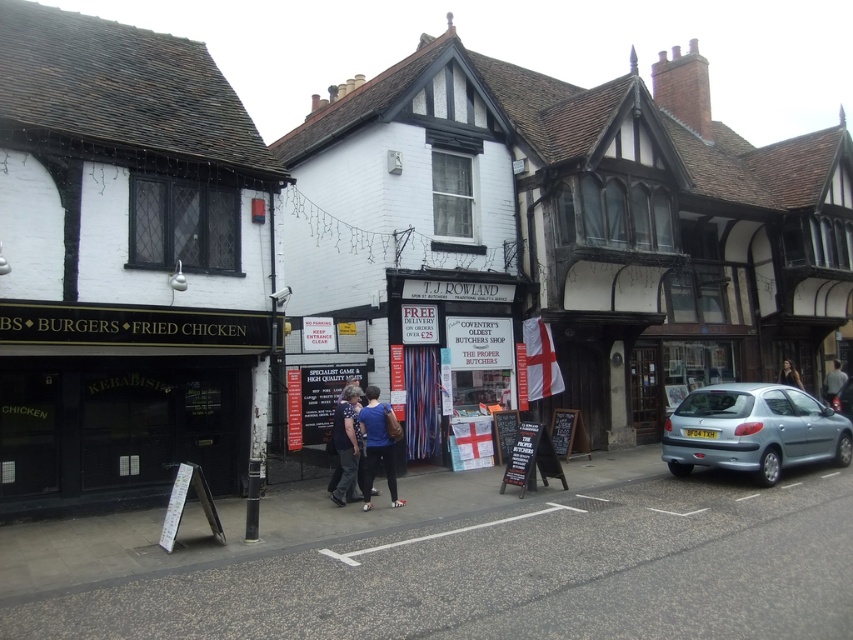
Is metallic silver car at right in front of gray fabric shirt at center-right?

That is True.

Can you confirm if metallic silver car at right is positioned to the right of gray fabric shirt at center-right?

No, metallic silver car at right is not to the right of gray fabric shirt at center-right.

The height and width of the screenshot is (640, 853). Describe the element at coordinates (753, 429) in the screenshot. I see `metallic silver car at right` at that location.

This screenshot has height=640, width=853. I want to click on metallic silver car at right, so click(753, 429).

Does gray fabric shirt at center-right appear on the right side of dark hair at center?

Yes, gray fabric shirt at center-right is to the right of dark hair at center.

Can you confirm if gray fabric shirt at center-right is taller than dark hair at center?

Yes, gray fabric shirt at center-right is taller than dark hair at center.

The height and width of the screenshot is (640, 853). Find the location of `gray fabric shirt at center-right`. gray fabric shirt at center-right is located at coordinates (834, 380).

Can you confirm if metallic silver car at right is bigger than dark hair at center?

Correct, metallic silver car at right is larger in size than dark hair at center.

Who is shorter, metallic silver car at right or dark hair at center?

Standing shorter between the two is dark hair at center.

Locate an element on the screen. The width and height of the screenshot is (853, 640). metallic silver car at right is located at coordinates (753, 429).

Find the location of a particular element. This screenshot has width=853, height=640. metallic silver car at right is located at coordinates (753, 429).